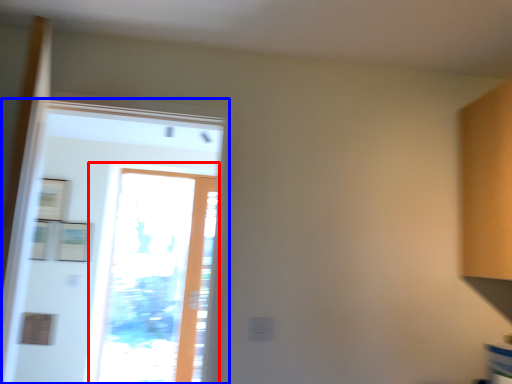
Question: Among these objects, which one is farthest to the camera, window (highlighted by a red box) or screen door (highlighted by a blue box)?

Choices:
 (A) window
 (B) screen door

Answer: (A)